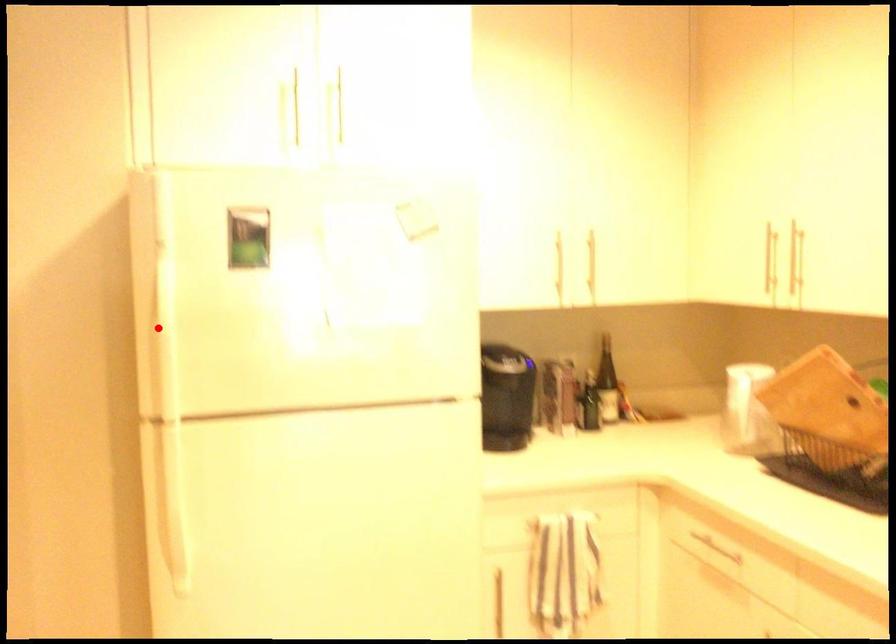
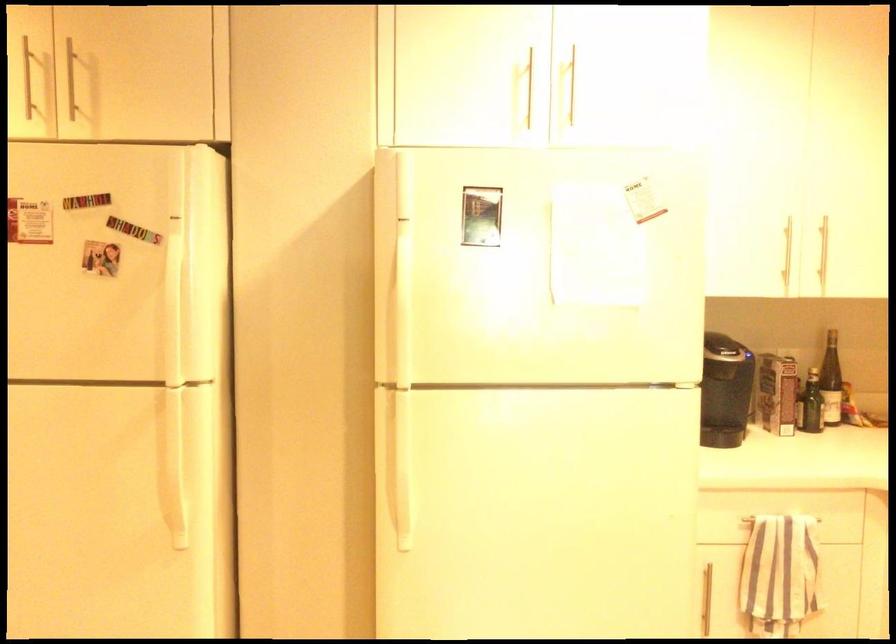
Locate, in the second image, the point that corresponds to the highlighted location in the first image.

(401, 298)